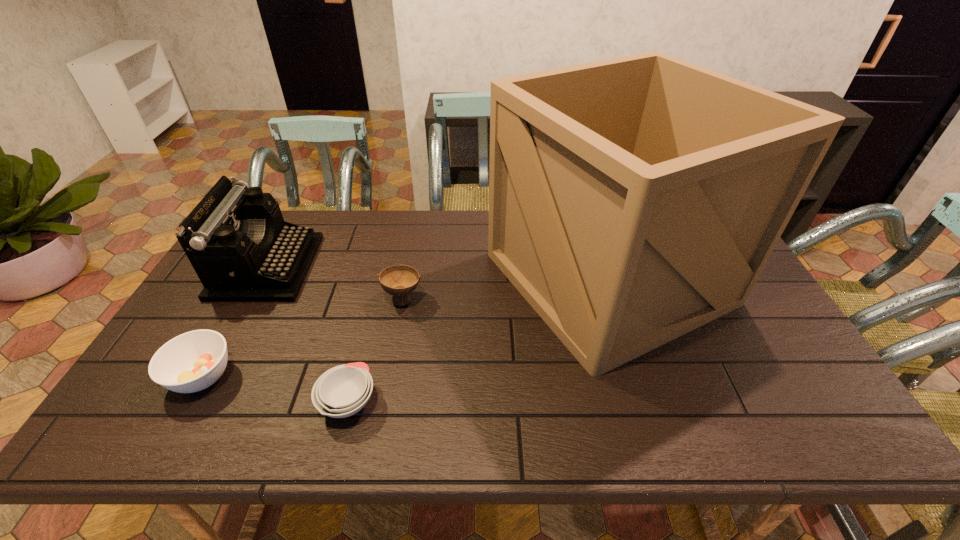
The height and width of the screenshot is (540, 960). In order to click on vacant region that satisfies the following two spatial constraints: 1. on the typing side of the fourth shortest object; 2. on the right side of the tallest object in this screenshot , I will do `click(261, 278)`.

This screenshot has width=960, height=540. I want to click on vacant position in the image that satisfies the following two spatial constraints: 1. on the typing side of the typewriter; 2. on the right side of the shortest soup bowl, so click(x=193, y=402).

Where is `free region that satisfies the following two spatial constraints: 1. on the typing side of the rightmost object; 2. on the right side of the typewriter`? free region that satisfies the following two spatial constraints: 1. on the typing side of the rightmost object; 2. on the right side of the typewriter is located at coordinates [261, 278].